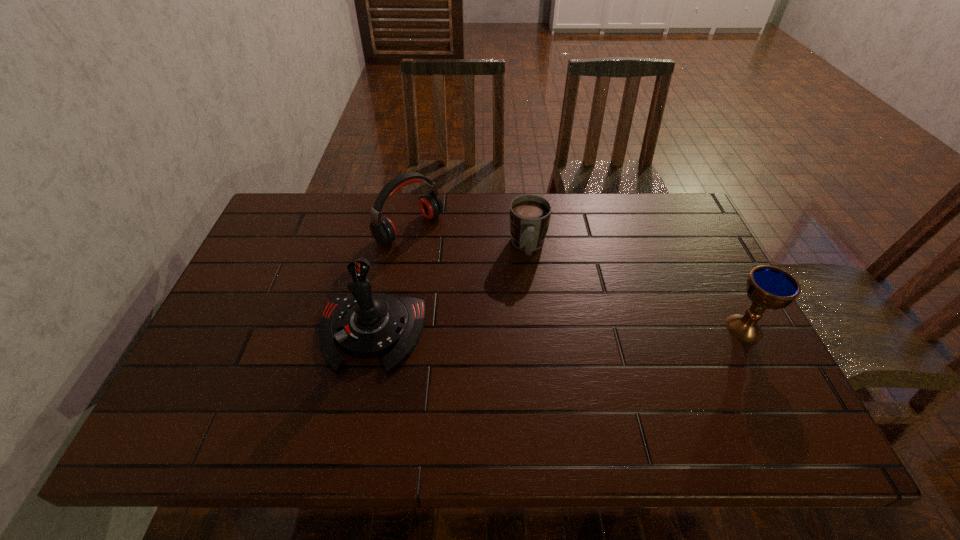
This screenshot has height=540, width=960. Find the location of `free point between the earphone and the second object from right to left`. free point between the earphone and the second object from right to left is located at coordinates (468, 238).

Where is `blank region between the rightmost object and the earphone`? blank region between the rightmost object and the earphone is located at coordinates (577, 278).

The width and height of the screenshot is (960, 540). I want to click on object that stands as the third closest to the earphone, so click(x=768, y=287).

Locate which object ranks in proximity to the joystick. Please provide its 2D coordinates. Your answer should be formatted as a tuple, i.e. [(x, y)], where the tuple contains the x and y coordinates of a point satisfying the conditions above.

[(383, 230)]

Where is `free space that satisfies the following two spatial constraints: 1. on the front side of the mug; 2. on the right side of the chalice`? free space that satisfies the following two spatial constraints: 1. on the front side of the mug; 2. on the right side of the chalice is located at coordinates point(538,328).